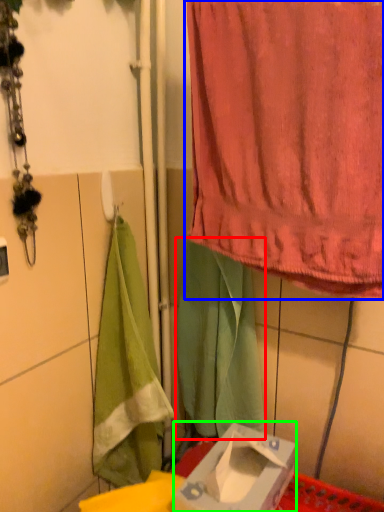
Question: Based on their relative distances, which object is nearer to cloth (highlighted by a red box)? Choose from curtain (highlighted by a blue box) and box (highlighted by a green box).

Choices:
 (A) curtain
 (B) box

Answer: (B)